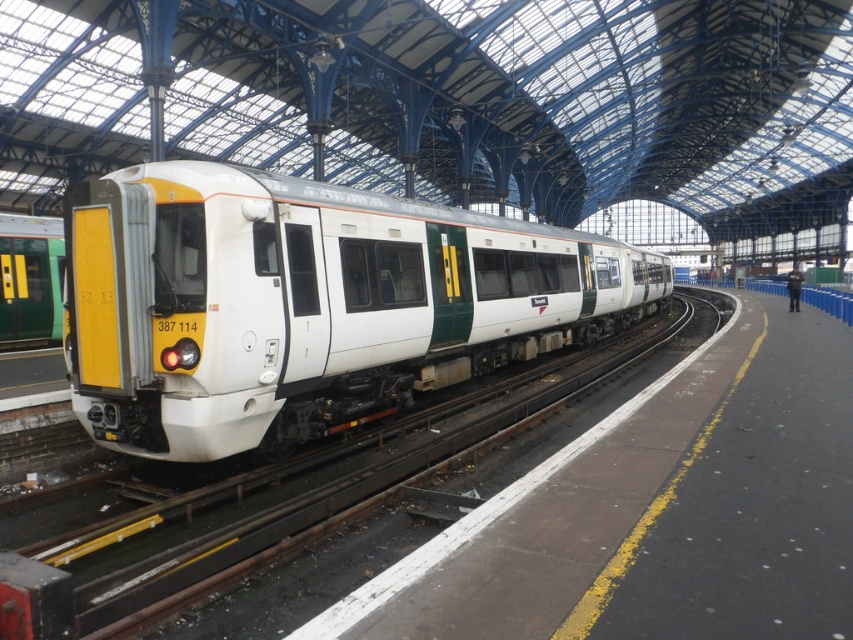
Question: Does white metal track at center have a larger size compared to yellow/green plastic train at left?

Choices:
 (A) yes
 (B) no

Answer: (A)

Question: Can you confirm if white glossy train at center is positioned below white metal track at center?

Choices:
 (A) no
 (B) yes

Answer: (A)

Question: Where is white glossy train at center located in relation to yellow/green plastic train at left in the image?

Choices:
 (A) above
 (B) below

Answer: (B)

Question: Which point is farther to the camera?

Choices:
 (A) yellow/green plastic train at left
 (B) white metal track at center

Answer: (A)

Question: Based on their relative distances, which object is farther from the white metal track at center?

Choices:
 (A) yellow/green plastic train at left
 (B) white glossy train at center

Answer: (A)

Question: Which point is closer to the camera taking this photo?

Choices:
 (A) (38, 324)
 (B) (30, 616)

Answer: (B)